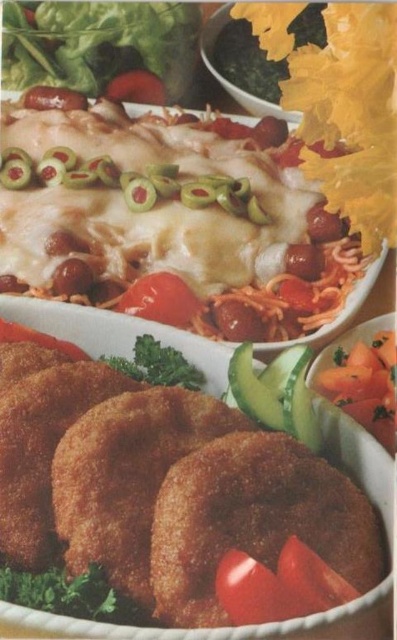
You are a food critic evaluating this dish. You notice two elements, the green leafy vegetable at upper left and the red glossy tomato at center. Which one is closer to you?

The green leafy vegetable at upper left is closer to you than the red glossy tomato at center.

Please look at the image of the food spread. Where exactly is the green leafy vegetable at upper left located in terms of coordinates?

The green leafy vegetable at upper left is located at point [98,44].